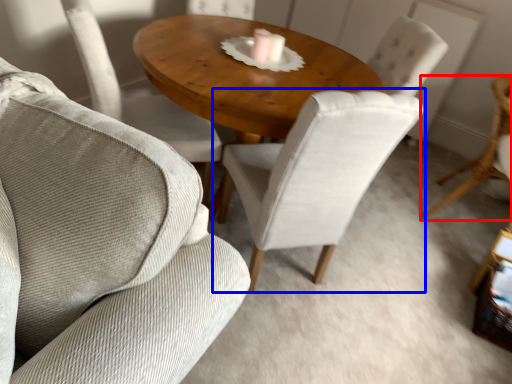
Question: Which object is closer to the camera taking this photo, chair (highlighted by a red box) or chair (highlighted by a blue box)?

Choices:
 (A) chair
 (B) chair

Answer: (B)